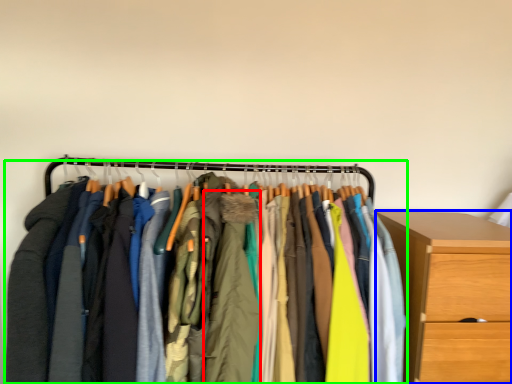
Question: Considering the real-world distances, which object is farthest from clothing (highlighted by a red box)? chest of drawers (highlighted by a blue box) or closet (highlighted by a green box)?

Choices:
 (A) chest of drawers
 (B) closet

Answer: (A)